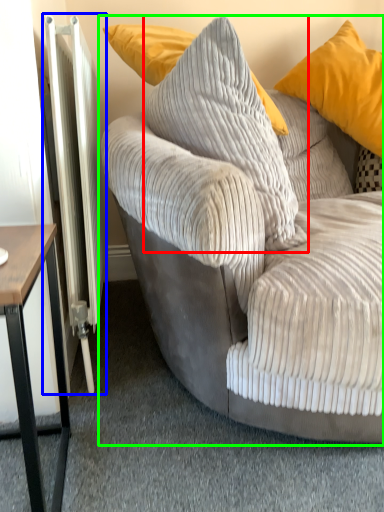
Question: Considering the real-world distances, which object is closest to pillow (highlighted by a red box)? radiator (highlighted by a blue box) or studio couch (highlighted by a green box).

Choices:
 (A) radiator
 (B) studio couch

Answer: (B)